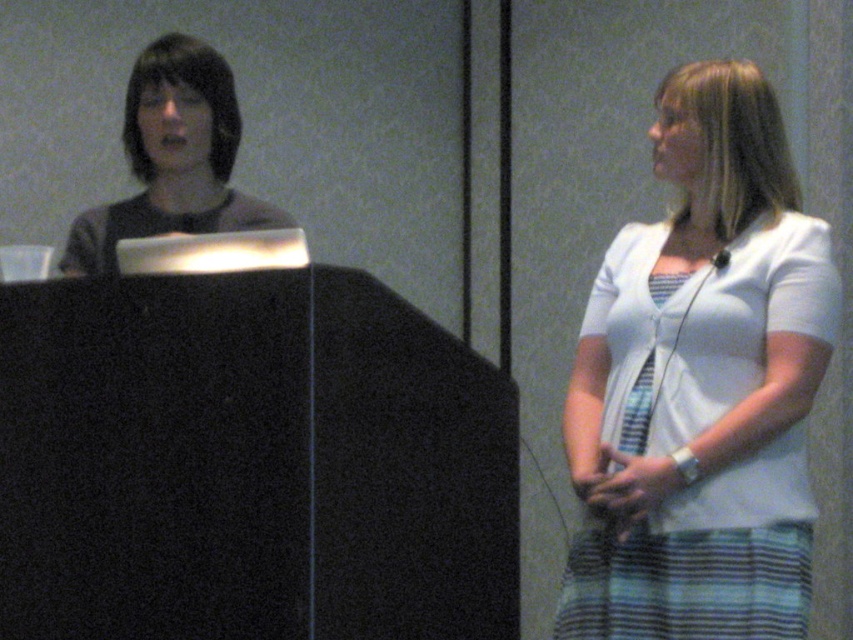
Question: Does white textured blouse at center appear under matte black shirt at left?

Choices:
 (A) yes
 (B) no

Answer: (A)

Question: Which of the following is the farthest from the observer?

Choices:
 (A) white textured blouse at center
 (B) matte black shirt at left

Answer: (B)

Question: Is white textured blouse at center closer to the viewer compared to matte black shirt at left?

Choices:
 (A) yes
 (B) no

Answer: (A)

Question: Does white textured blouse at center appear under matte black shirt at left?

Choices:
 (A) yes
 (B) no

Answer: (A)

Question: Among these objects, which one is farthest from the camera?

Choices:
 (A) white textured blouse at center
 (B) matte black shirt at left

Answer: (B)

Question: Which point is closer to the camera?

Choices:
 (A) white textured blouse at center
 (B) matte black shirt at left

Answer: (A)